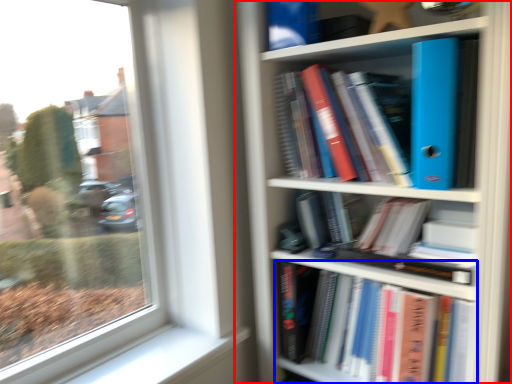
Question: Which object appears closest to the camera in this image, bookcase (highlighted by a red box) or book (highlighted by a blue box)?

Choices:
 (A) bookcase
 (B) book

Answer: (A)